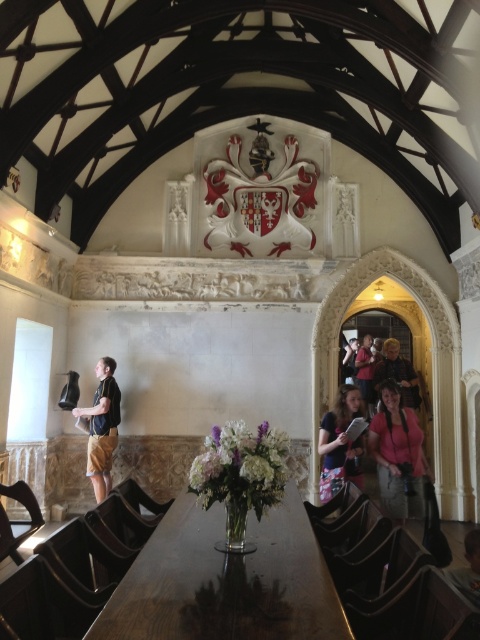
Question: Does matte black shirt at left appear over matte black shirt at right?

Choices:
 (A) yes
 (B) no

Answer: (B)

Question: Which is farther from the pink fabric at lower right?

Choices:
 (A) matte black shirt at left
 (B) wooden table at center
 (C) matte pink shirt at center

Answer: (A)

Question: Which object appears farthest from the camera in this image?

Choices:
 (A) wooden table at center
 (B) matte black shirt at left
 (C) matte black shirt at right
 (D) pink fabric at lower right

Answer: (C)

Question: Does wooden table at center appear over matte black shirt at right?

Choices:
 (A) yes
 (B) no

Answer: (B)

Question: Among these points, which one is farthest from the camera?

Choices:
 (A) (x=324, y=444)
 (B) (x=317, y=580)
 (C) (x=361, y=376)
 (D) (x=110, y=384)

Answer: (C)

Question: Does matte pink shirt at center appear on the right side of matte black shirt at right?

Choices:
 (A) yes
 (B) no

Answer: (B)